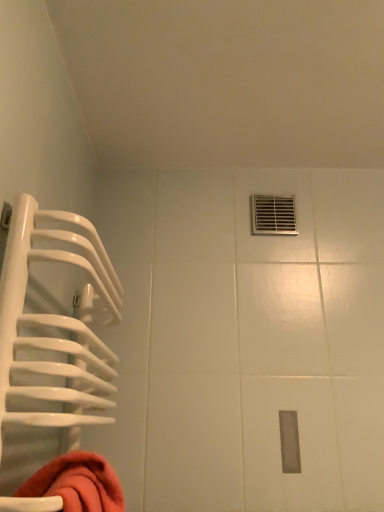
Question: Does point (72, 244) appear closer or farther from the camera than point (278, 228)?

Choices:
 (A) closer
 (B) farther

Answer: (A)

Question: Looking at their shapes, would you say white glossy towel rack at left is wider or thinner than metallic vent at upper right?

Choices:
 (A) wide
 (B) thin

Answer: (A)

Question: From a real-world perspective, is white glossy towel rack at left above or below metallic vent at upper right?

Choices:
 (A) below
 (B) above

Answer: (A)

Question: From the image's perspective, is metallic vent at upper right positioned above or below white glossy towel rack at left?

Choices:
 (A) below
 (B) above

Answer: (B)

Question: Considering the positions of metallic vent at upper right and white glossy towel rack at left in the image, is metallic vent at upper right bigger or smaller than white glossy towel rack at left?

Choices:
 (A) small
 (B) big

Answer: (A)

Question: From their relative heights in the image, would you say metallic vent at upper right is taller or shorter than white glossy towel rack at left?

Choices:
 (A) short
 (B) tall

Answer: (A)

Question: Is metallic vent at upper right situated inside white glossy towel rack at left or outside?

Choices:
 (A) inside
 (B) outside

Answer: (B)